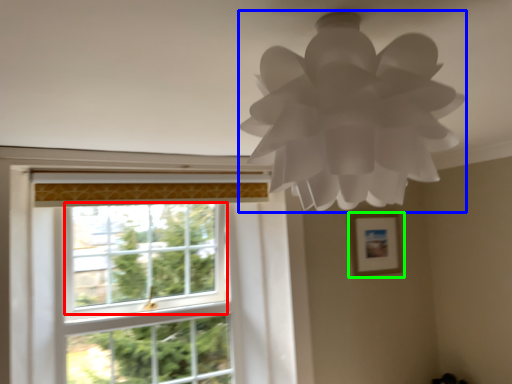
Question: Which is farther away from window screen (highlighted by a red box)? lamp (highlighted by a blue box) or picture frame (highlighted by a green box)?

Choices:
 (A) lamp
 (B) picture frame

Answer: (A)